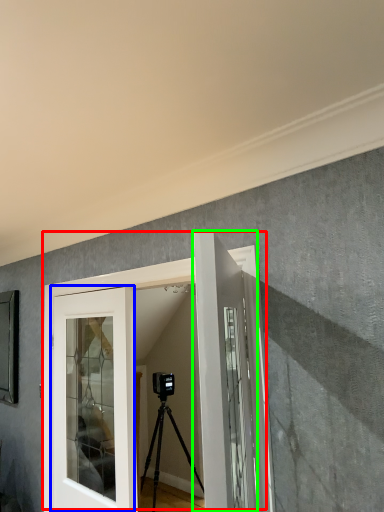
Question: Considering the real-world distances, which object is farthest from door (highlighted by a red box)? door (highlighted by a blue box) or door (highlighted by a green box)?

Choices:
 (A) door
 (B) door

Answer: (B)